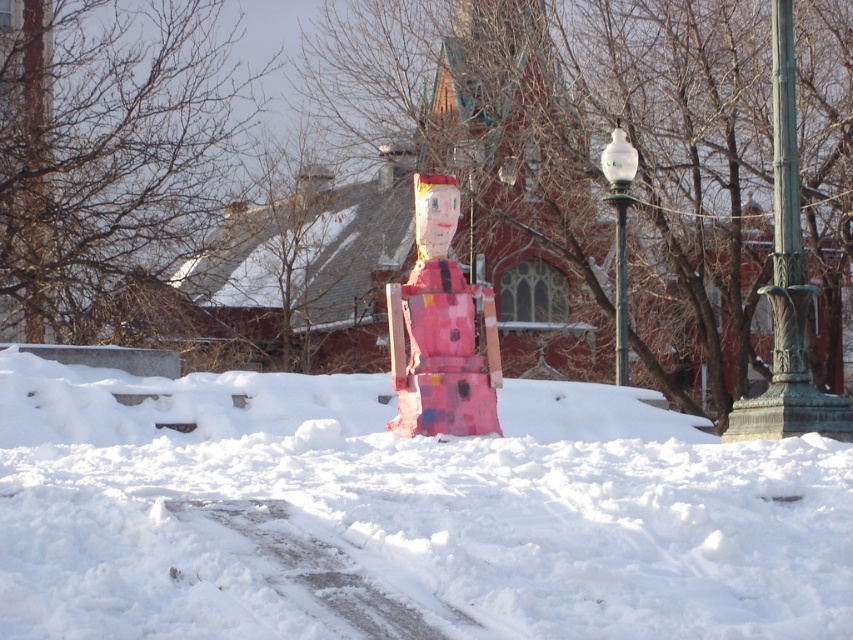
You are a delivery robot with a 30 feet range. You are currently at the white fluffy snow at center and need to deliver a package to the white glass lamp post at upper right. Can you reach it without moving?

The white fluffy snow at center is 28.08 feet away from the white glass lamp post at upper right, so yes, the delivery robot can reach it without moving since the distance is within its 30 feet range.